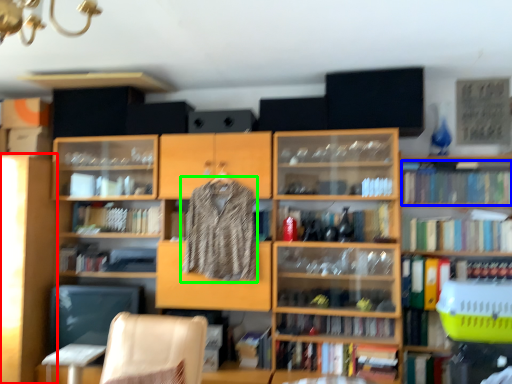
Question: Which object is the closest to the shelf (highlighted by a red box)? Choose among these: book (highlighted by a blue box) or clothing (highlighted by a green box).

Choices:
 (A) book
 (B) clothing

Answer: (B)